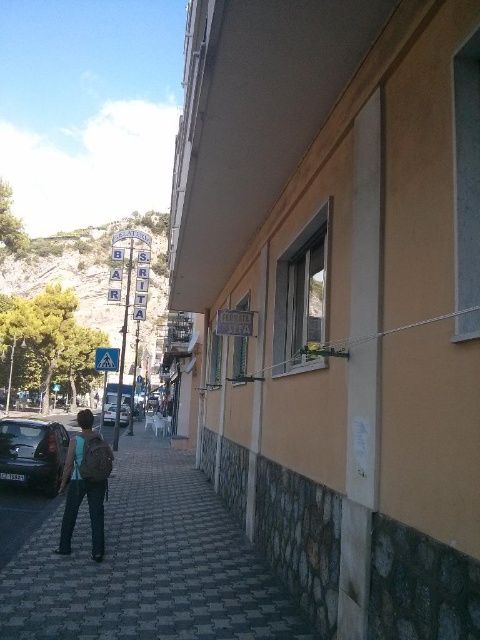
Measure the distance from brown backpack at center to silver metallic van at center.

brown backpack at center and silver metallic van at center are 63.68 feet apart.

The height and width of the screenshot is (640, 480). Describe the element at coordinates (84, 483) in the screenshot. I see `brown backpack at center` at that location.

This screenshot has height=640, width=480. Find the location of `brown backpack at center`. brown backpack at center is located at coordinates (84, 483).

Is dark gray paving stone at lower left below silver metallic van at center?

No.

Image resolution: width=480 pixels, height=640 pixels. What do you see at coordinates (144, 564) in the screenshot?
I see `dark gray paving stone at lower left` at bounding box center [144, 564].

This screenshot has height=640, width=480. What do you see at coordinates (144, 564) in the screenshot?
I see `dark gray paving stone at lower left` at bounding box center [144, 564].

Find the location of a particular element. dark gray paving stone at lower left is located at coordinates (144, 564).

Is shiny black car at lower left to the left of silver metallic van at center from the viewer's perspective?

Incorrect, shiny black car at lower left is not on the left side of silver metallic van at center.

Does shiny black car at lower left have a greater width compared to silver metallic van at center?

No, shiny black car at lower left is not wider than silver metallic van at center.

Which is behind, point (0, 451) or point (127, 417)?

Positioned behind is point (127, 417).

Where is `shiny black car at lower left`? The width and height of the screenshot is (480, 640). shiny black car at lower left is located at coordinates (33, 452).